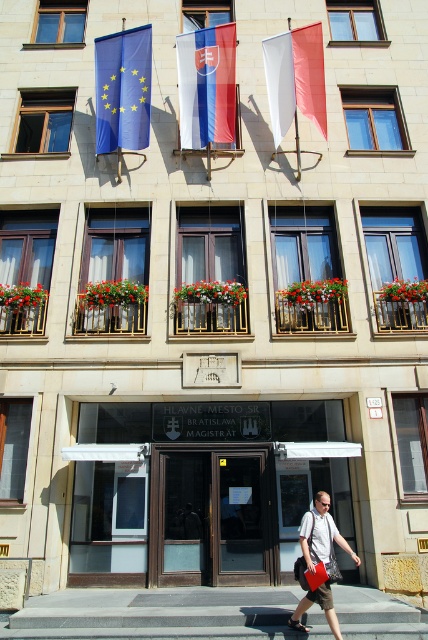
Does gray concrete stairs at center have a larger size compared to matte gray shirt at center?

Yes, gray concrete stairs at center is bigger than matte gray shirt at center.

Is gray concrete stairs at center positioned in front of matte gray shirt at center?

No, it is behind matte gray shirt at center.

I want to click on gray concrete stairs at center, so click(x=157, y=612).

In the scene shown: Does white fabric flag at center come behind matte gray shirt at center?

Yes, white fabric flag at center is behind matte gray shirt at center.

The image size is (428, 640). Find the location of `white fabric flag at center`. white fabric flag at center is located at coordinates (207, 84).

Is blue fabric flag at upper left further to camera compared to matte gray shirt at center?

That is True.

Is blue fabric flag at upper left to the left of matte gray shirt at center from the viewer's perspective?

Correct, you'll find blue fabric flag at upper left to the left of matte gray shirt at center.

Describe the element at coordinates (122, 90) in the screenshot. The image size is (428, 640). I see `blue fabric flag at upper left` at that location.

The width and height of the screenshot is (428, 640). In order to click on blue fabric flag at upper left in this screenshot , I will do `click(122, 90)`.